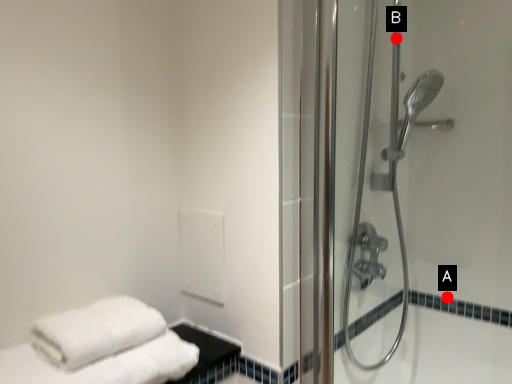
Question: Two points are circled on the image, labeled by A and B beside each circle. Among these points, which one is farthest from the camera?

Choices:
 (A) A is further
 (B) B is further

Answer: (A)